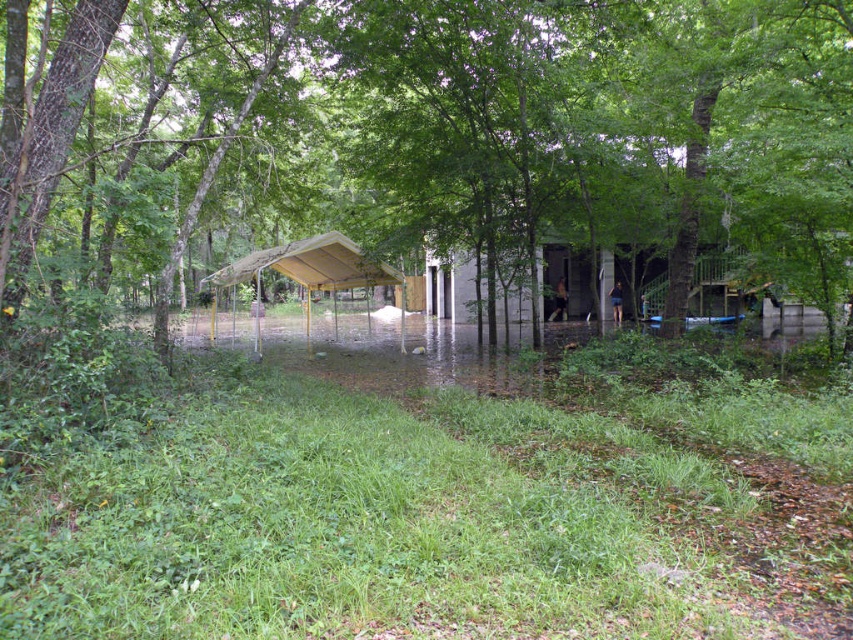
You are a surveyor assessing flood damage in the area. You notice the brown wood tree at center and the yellow metal carport at center. Which object is taller in this scene?

The brown wood tree at center is taller than the yellow metal carport at center.

You are standing at the edge of the flooded area and see the brown wood tree at center and the yellow metal carport at center. Which object is positioned to the right when looking towards the scene?

The brown wood tree at center is to the right of the yellow metal carport at center.